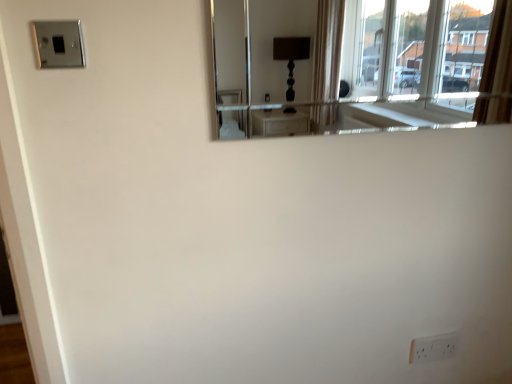
Identify the location of metallic silver light switch at upper left. The height and width of the screenshot is (384, 512). (58, 44).

What do you see at coordinates (58, 44) in the screenshot? This screenshot has height=384, width=512. I see `metallic silver light switch at upper left` at bounding box center [58, 44].

Locate an element on the screen. metallic silver light switch at upper left is located at coordinates (58, 44).